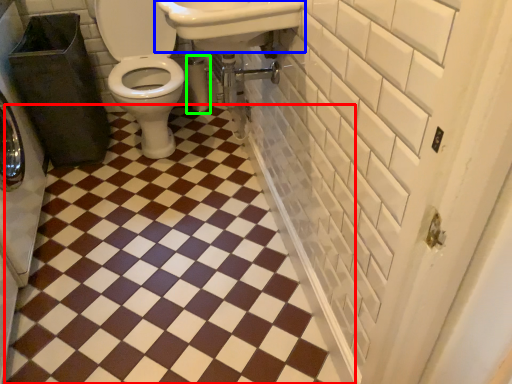
Question: Estimate the real-world distances between objects in this image. Which object is farther from ceramic tile (highlighted by a red box), sink (highlighted by a blue box) or toilet paper (highlighted by a green box)?

Choices:
 (A) sink
 (B) toilet paper

Answer: (B)